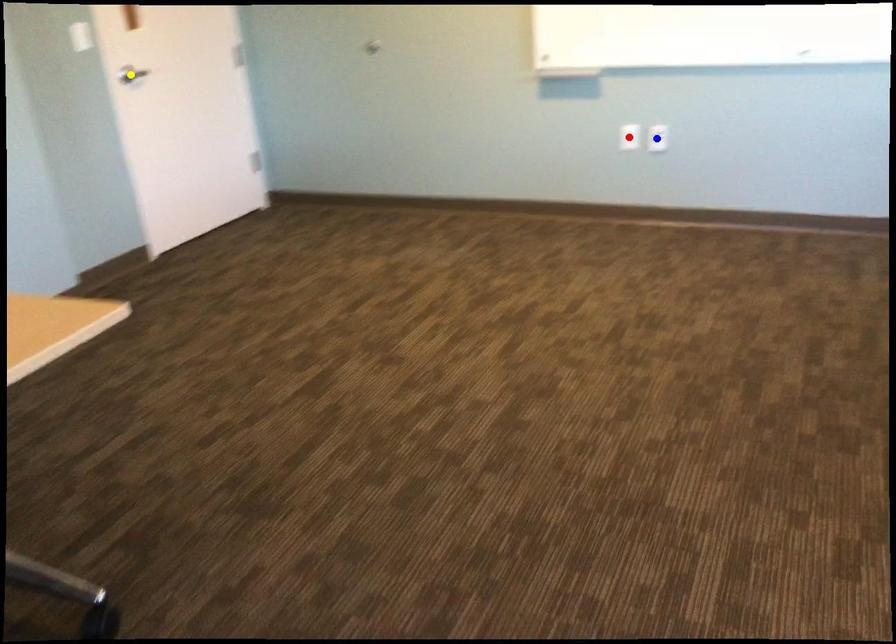
Order these from nearest to farthest:
- blue point
- red point
- yellow point

yellow point → red point → blue point